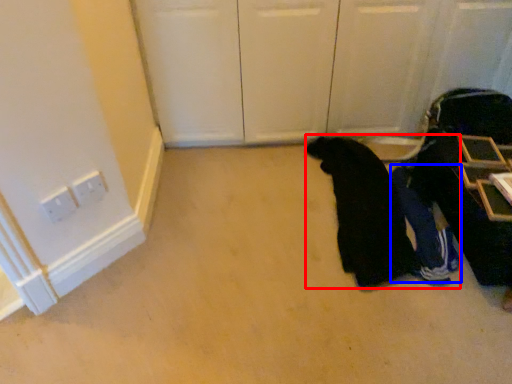
Question: Among these objects, which one is farthest to the camera, person (highlighted by a red box) or person (highlighted by a blue box)?

Choices:
 (A) person
 (B) person

Answer: (B)